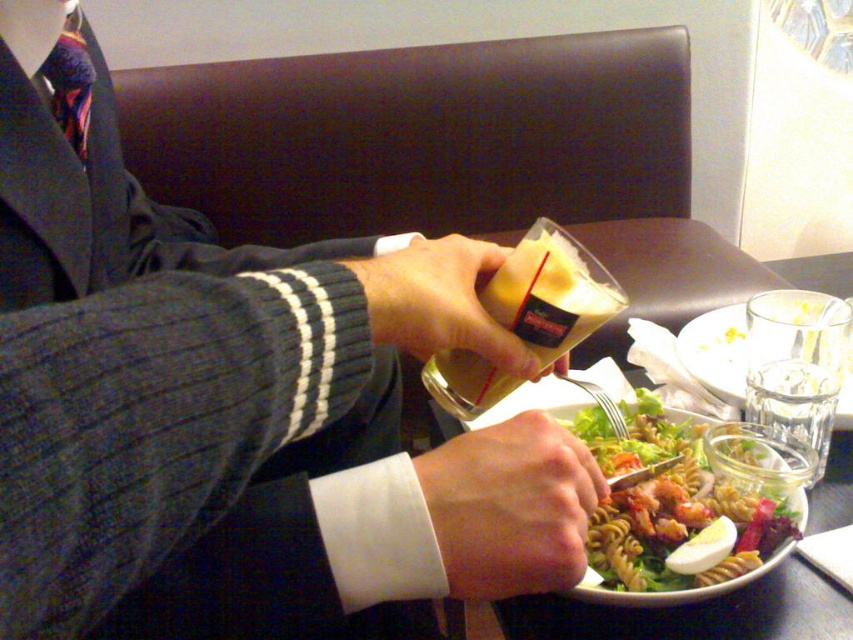
Is white matte hand at lower center positioned before matte plastic cup at center?

No, white matte hand at lower center is further to the viewer.

Can you confirm if white matte hand at lower center is shorter than matte plastic cup at center?

Yes.

Find the location of a particular element. The height and width of the screenshot is (640, 853). white matte hand at lower center is located at coordinates [x=509, y=506].

Looking at this image, is matte plastic salad bowl at center bigger than matte plastic cup at center?

Yes.

Does point (577, 621) come in front of point (437, 262)?

No, it is behind (437, 262).

Who is more forward, (851, 522) or (447, 314)?

Point (447, 314)

Where is `matte plastic salad bowl at center`? matte plastic salad bowl at center is located at coordinates (695, 612).

Is white matte hand at lower center further to the viewer compared to matte plastic salad bowl at center?

No, it is in front of matte plastic salad bowl at center.

Does white matte hand at lower center have a lesser width compared to matte plastic salad bowl at center?

Yes, white matte hand at lower center is thinner than matte plastic salad bowl at center.

Identify the location of white matte hand at lower center. (509, 506).